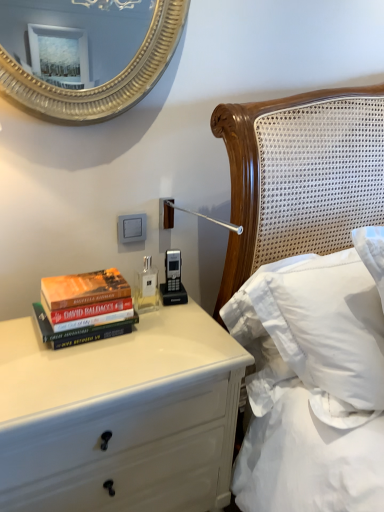
Find the location of a particular element. The height and width of the screenshot is (512, 384). free spot in front of clear glass bottle at center is located at coordinates (150, 343).